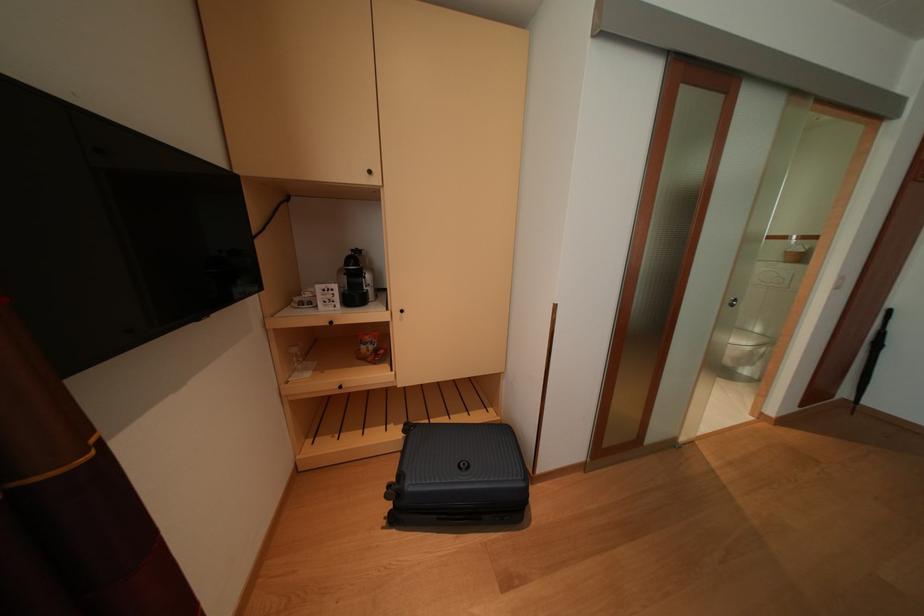
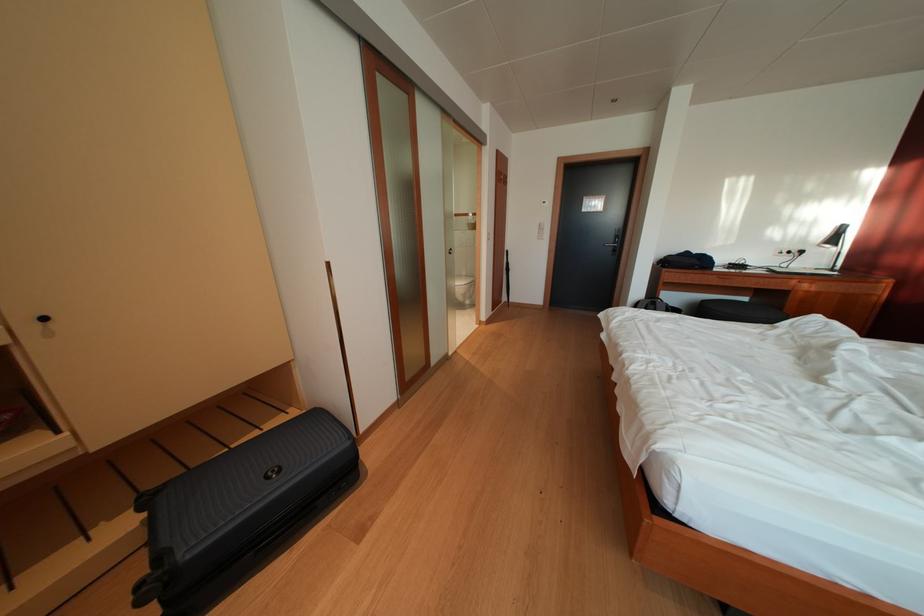
Question: The images are taken continuously from a first-person perspective. In which direction is your viewpoint rotating?

Choices:
 (A) Left
 (B) Right
 (C) Up
 (D) Down

Answer: (B)